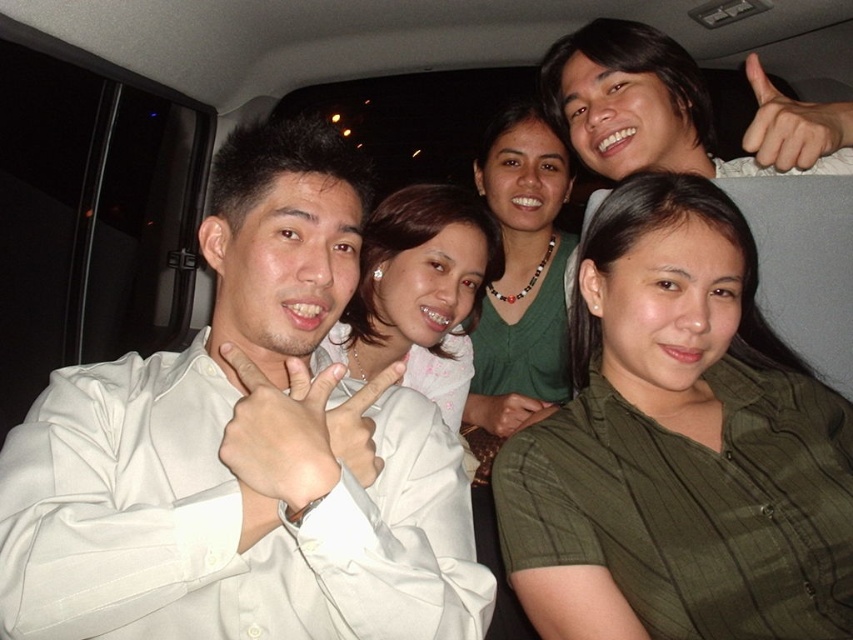
You are sitting in the backseat of a car at night and see two points marked in the scene. The first point is at coordinates point (x=270, y=160) and the second point is at point (x=363, y=445). Which point is closer to you?

Point (x=270, y=160) is closer to you because it is further to the viewer than point (x=363, y=445).

In the scene shown: You are a photographer trying to capture a candid shot of the white satin shirt at left and the white matte hand at center in the car scene. The camera has a depth of field that can focus on objects within a 4 inch range. Can you focus on both subjects simultaneously?

The white satin shirt at left is 4.05 inches from the white matte hand at center. Since the distance between them exceeds the camera lens depth of field range of 4 inches, the camera cannot focus on both subjects at the same time.